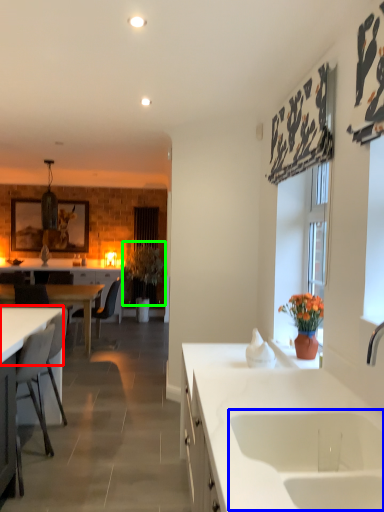
Question: Considering the real-world distances, which object is closest to countertop (highlighted by a red box)? sink (highlighted by a blue box) or plant (highlighted by a green box).

Choices:
 (A) sink
 (B) plant

Answer: (A)